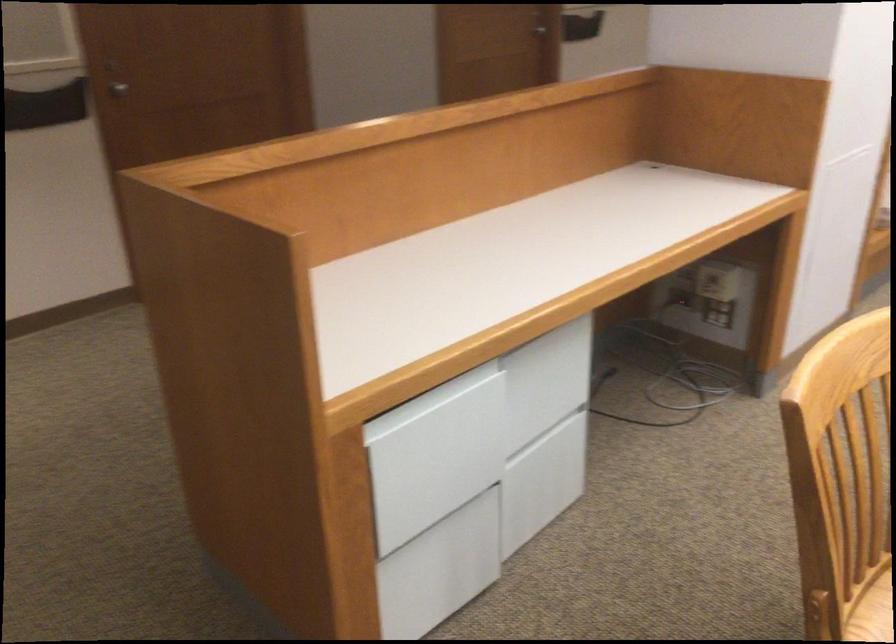
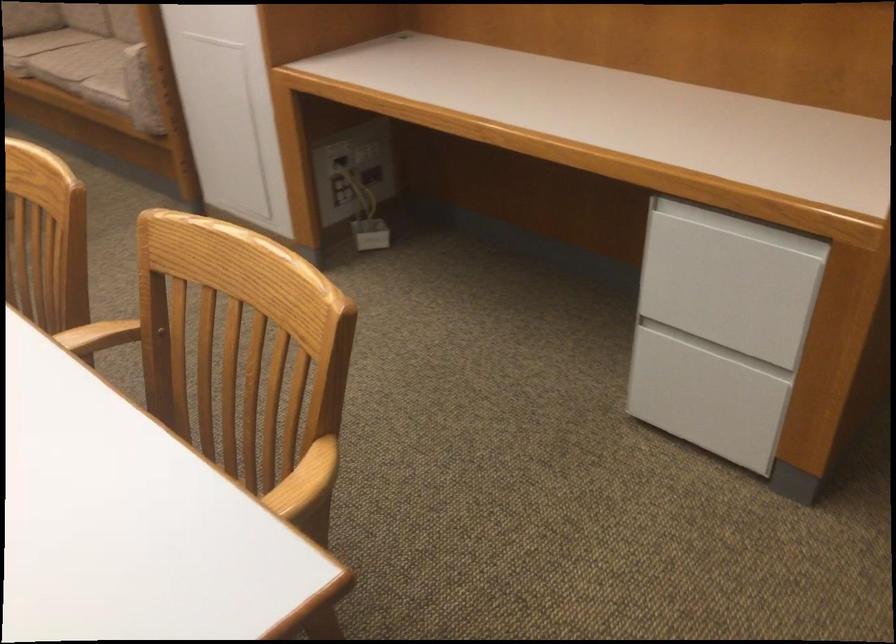
Based on the continuous images, in which direction is the camera rotating?

The camera rotated toward right-down.